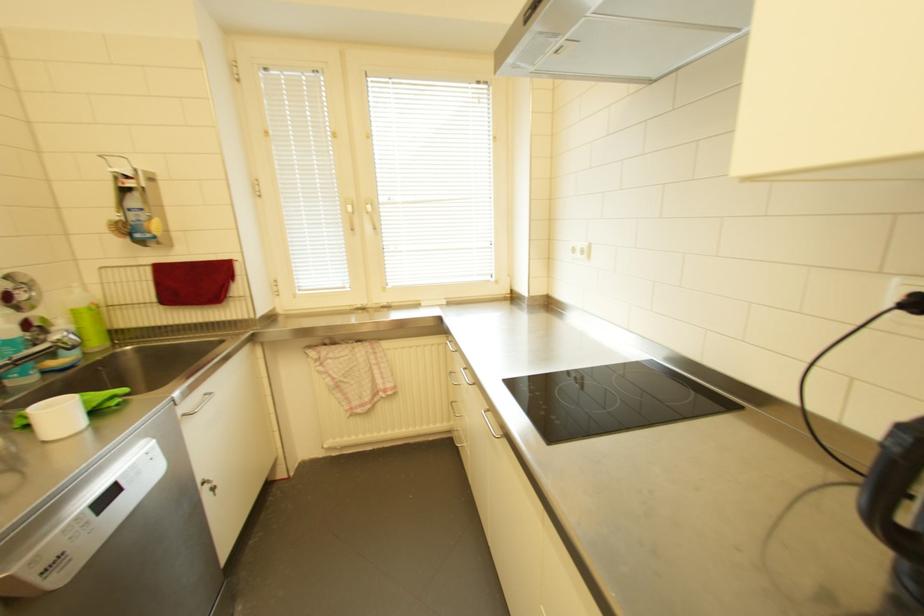
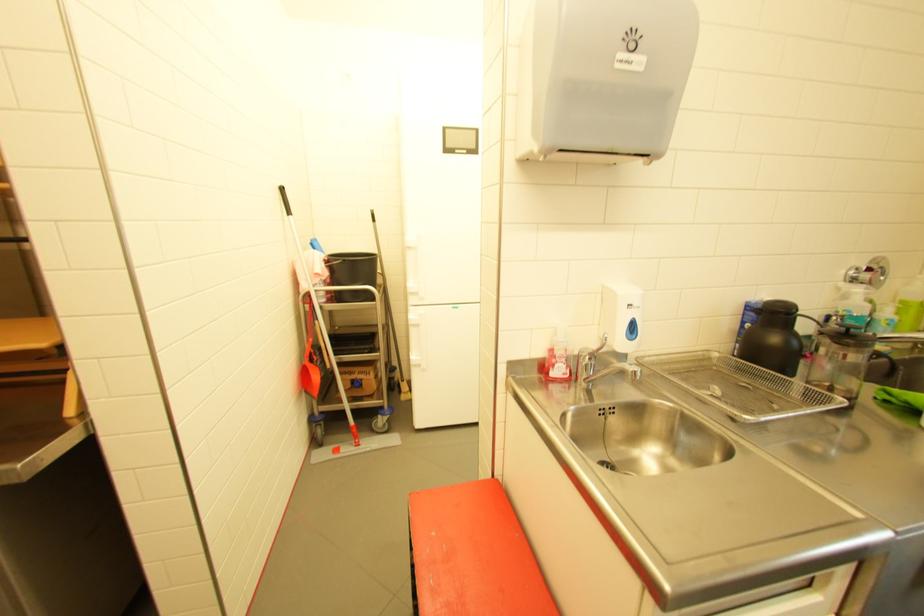
The first image is from the beginning of the video and the second image is from the end. How did the camera likely rotate when shooting the video?

The camera rotated toward left-down.